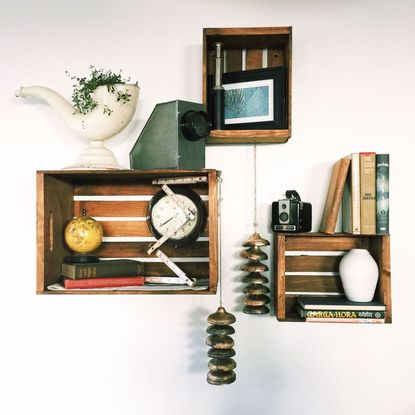
At what (x,y) coordinates should I click in order to perform the action: click on shelf. Please return your answer as a coordinate pair (x, y). Looking at the image, I should click on (279, 293).